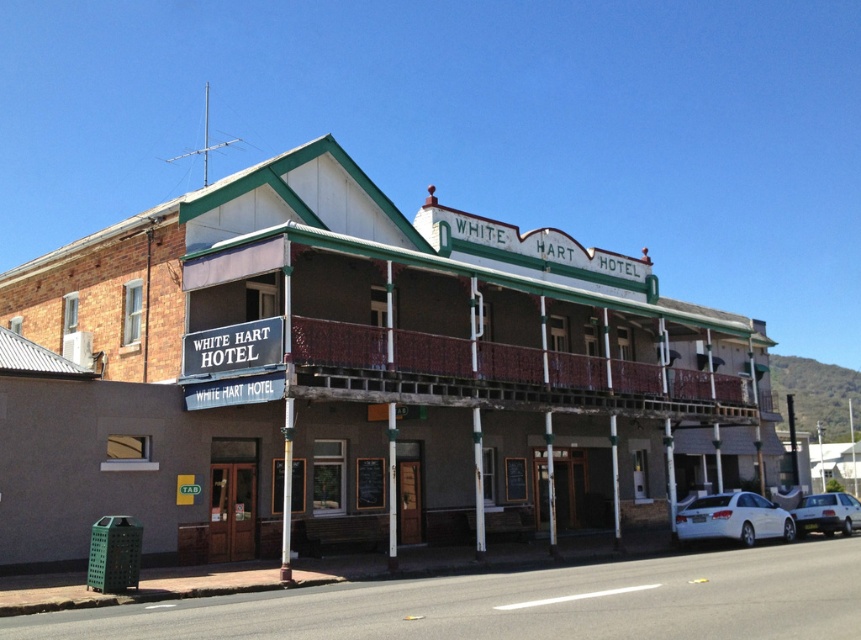
Which is below, white glossy sedan at lower right or black metal signboard at lower left?

white glossy sedan at lower right is lower down.

Is white glossy sedan at lower right to the left of black metal signboard at lower left from the viewer's perspective?

In fact, white glossy sedan at lower right is to the right of black metal signboard at lower left.

Describe the element at coordinates (733, 518) in the screenshot. I see `white glossy sedan at lower right` at that location.

Where is `white glossy sedan at lower right`? white glossy sedan at lower right is located at coordinates (733, 518).

Can you confirm if black metal signboard at lower left is wider than silver metallic sedan at lower right?

Incorrect, black metal signboard at lower left's width does not surpass silver metallic sedan at lower right's.

Who is more distant from viewer, (249, 355) or (853, 522)?

The point (853, 522) is behind.

Is point (193, 356) farther from viewer compared to point (841, 499)?

No, it is in front of (841, 499).

Where is `black metal signboard at lower left`? This screenshot has width=861, height=640. black metal signboard at lower left is located at coordinates (x=233, y=346).

Can you confirm if brown textured building at center is positioned below black metal signboard at lower left?

No.

Who is positioned more to the right, brown textured building at center or black metal signboard at lower left?

brown textured building at center is more to the right.

This screenshot has height=640, width=861. What do you see at coordinates (357, 374) in the screenshot?
I see `brown textured building at center` at bounding box center [357, 374].

Locate an element on the screen. brown textured building at center is located at coordinates [x=357, y=374].